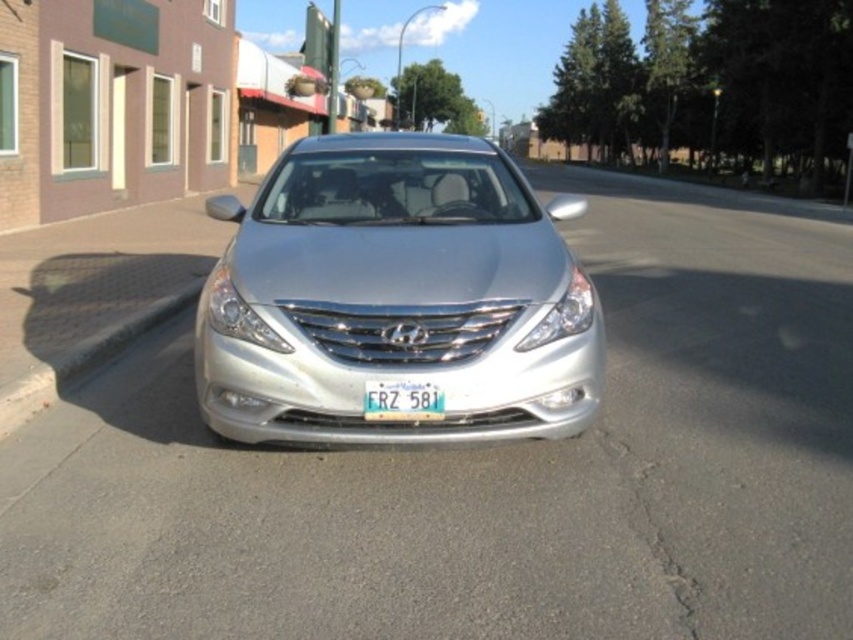
Does silver metallic sedan at center have a greater height compared to white plastic license plate at center?

Yes.

Is point (367, 188) positioned after point (366, 394)?

Yes.

You are a GUI agent. You are given a task and a screenshot of the screen. Output one action in this format:
    pyautogui.click(x=<x>, y=<y>)
    Task: Click on the silver metallic sedan at center
    This screenshot has height=640, width=853.
    Given the screenshot: What is the action you would take?
    pyautogui.click(x=396, y=298)

Does point (18, 397) lie in front of point (399, 406)?

No, it is not.

Which is in front, point (91, 365) or point (366, 417)?

Point (366, 417) is more forward.

Does point (59, 358) come in front of point (364, 410)?

No, (59, 358) is further to viewer.

At what (x,y) coordinates should I click in order to perform the action: click on black asphalt curb at lower left. Please return your answer as a coordinate pair (x, y). The height and width of the screenshot is (640, 853). Looking at the image, I should click on (84, 358).

Is silver metallic sedan at center in front of black asphalt curb at lower left?

No, it is behind black asphalt curb at lower left.

Is silver metallic sedan at center wider than black asphalt curb at lower left?

Correct, the width of silver metallic sedan at center exceeds that of black asphalt curb at lower left.

Which is in front, point (364, 256) or point (129, 320)?

Point (364, 256)

This screenshot has width=853, height=640. Find the location of `silver metallic sedan at center`. silver metallic sedan at center is located at coordinates (396, 298).